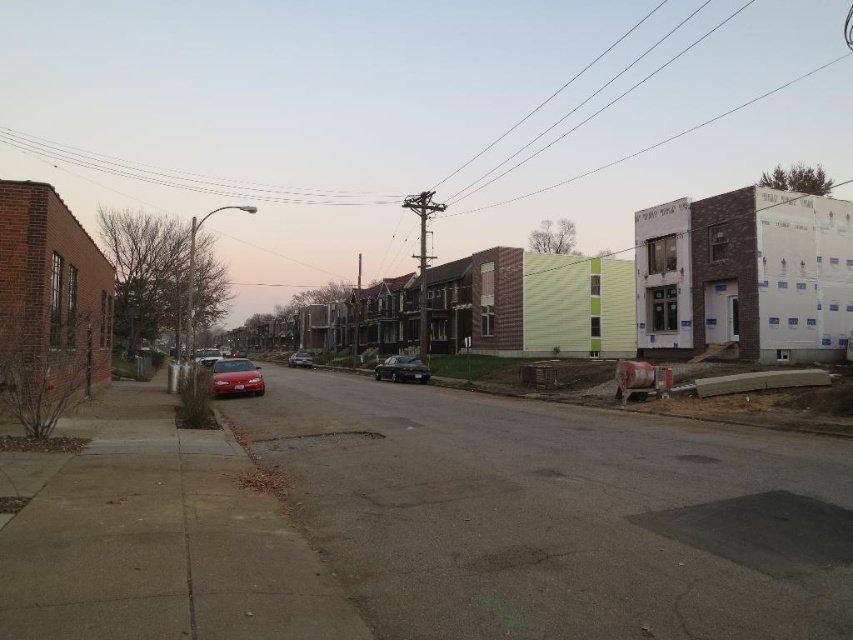
Who is positioned more to the left, black wire at upper center or shiny black sedan at center?

From the viewer's perspective, black wire at upper center appears more on the left side.

Identify the location of black wire at upper center. (187, 177).

Does point (178, 186) come farther from viewer compared to point (422, 376)?

Yes.

Locate an element on the screen. Image resolution: width=853 pixels, height=640 pixels. black wire at upper center is located at coordinates (187, 177).

Is shiny black sedan at center taller than shiny silver sedan at center?

No.

Between shiny black sedan at center and shiny silver sedan at center, which one appears on the right side from the viewer's perspective?

Positioned to the right is shiny black sedan at center.

Locate an element on the screen. Image resolution: width=853 pixels, height=640 pixels. shiny black sedan at center is located at coordinates (402, 369).

Is smooth wire at upper center below shiny silver sedan at center?

No, smooth wire at upper center is not below shiny silver sedan at center.

Does point (486, 179) lie behind point (300, 360)?

Yes, it is behind point (300, 360).

Which is behind, point (566, 116) or point (305, 364)?

The point (566, 116) is behind.

Locate an element on the screen. smooth wire at upper center is located at coordinates (592, 97).